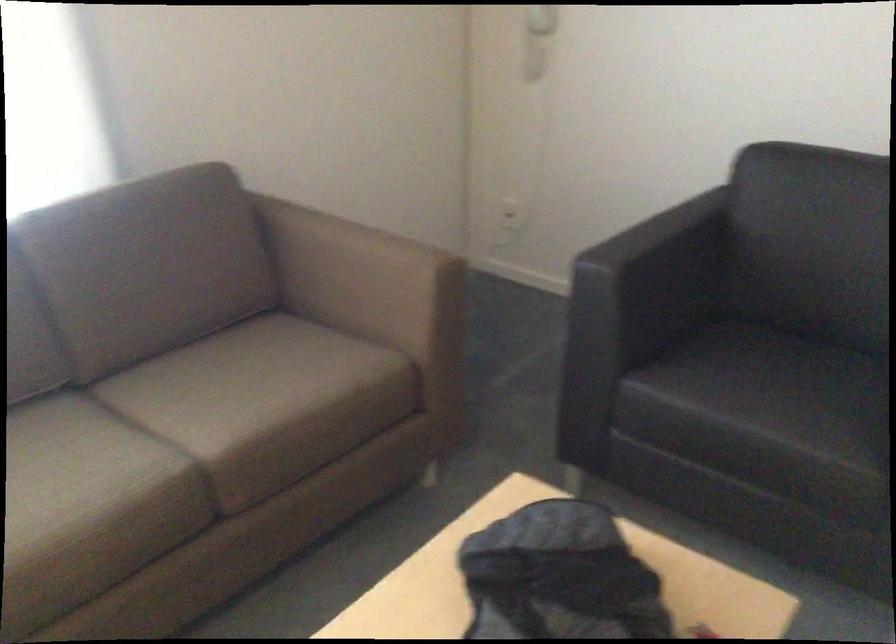
Where would you resting arm the brown sofa armrest? Please return your answer as a coordinate pair (x, y).

(363, 277)